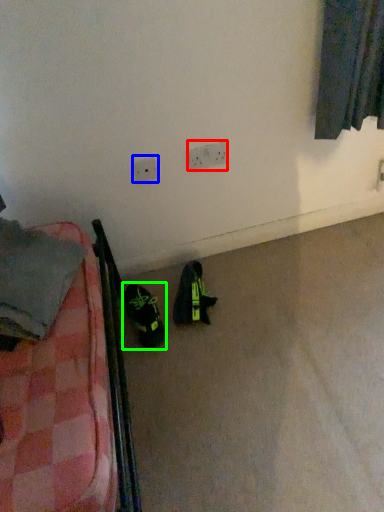
Question: Based on their relative distances, which object is nearer to electric outlet (highlighted by a red box)? Choose from electric outlet (highlighted by a blue box) and footwear (highlighted by a green box).

Choices:
 (A) electric outlet
 (B) footwear

Answer: (A)